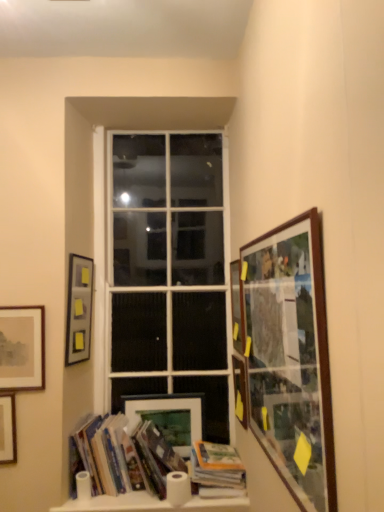
Question: Considering the relative sizes of white matte toilet paper at lower left, which ranks as the 1th toilet paper in left-to-right order, and matte glass picture frame at right, marked as the sixth picture frame in a left-to-right arrangement, in the image provided, is white matte toilet paper at lower left, which ranks as the 1th toilet paper in left-to-right order, thinner than matte glass picture frame at right, marked as the sixth picture frame in a left-to-right arrangement,?

Choices:
 (A) yes
 (B) no

Answer: (B)

Question: Does white matte toilet paper at lower left, which ranks as the 1th toilet paper in left-to-right order, have a larger size compared to matte glass picture frame at right, marked as the sixth picture frame in a left-to-right arrangement?

Choices:
 (A) yes
 (B) no

Answer: (B)

Question: Is white matte toilet paper at lower left, the second toilet paper when ordered from right to left, directly adjacent to matte glass picture frame at right, acting as the second picture frame starting from the right?

Choices:
 (A) no
 (B) yes

Answer: (A)

Question: Can you confirm if white matte toilet paper at lower left, the second toilet paper when ordered from right to left, is taller than matte glass picture frame at right, marked as the sixth picture frame in a left-to-right arrangement?

Choices:
 (A) yes
 (B) no

Answer: (B)

Question: Is white matte toilet paper at lower left, which ranks as the 1th toilet paper in left-to-right order, further to camera compared to matte glass picture frame at right, acting as the second picture frame starting from the right?

Choices:
 (A) yes
 (B) no

Answer: (B)

Question: From the image's perspective, is hardcover books at lower left, placed as the second book when sorted from right to left, located above or below wooden-framed collage at right, positioned as the seventh picture frame in left-to-right order?

Choices:
 (A) below
 (B) above

Answer: (A)

Question: Considering their positions, is hardcover books at lower left, placed as the second book when sorted from right to left, located in front of or behind wooden-framed collage at right, positioned as the seventh picture frame in left-to-right order?

Choices:
 (A) front
 (B) behind

Answer: (B)

Question: Is hardcover books at lower left, placed as the second book when sorted from right to left, inside the boundaries of wooden-framed collage at right, positioned as the seventh picture frame in left-to-right order, or outside?

Choices:
 (A) outside
 (B) inside

Answer: (A)

Question: In terms of width, does hardcover books at lower left, placed as the second book when sorted from right to left, look wider or thinner when compared to wooden-framed collage at right, the 1th picture frame when ordered from right to left?

Choices:
 (A) wide
 (B) thin

Answer: (A)

Question: Which is correct: matte brown picture frame at left, which is counted as the 2th picture frame, starting from the left, is inside matte wooden picture frame at lower center, acting as the 4th picture frame starting from the right, or outside of it?

Choices:
 (A) outside
 (B) inside

Answer: (A)

Question: From the image's perspective, is matte brown picture frame at left, acting as the 6th picture frame starting from the right, above or below matte wooden picture frame at lower center, acting as the 4th picture frame starting from the right?

Choices:
 (A) below
 (B) above

Answer: (B)

Question: Is matte brown picture frame at left, acting as the 6th picture frame starting from the right, bigger or smaller than matte wooden picture frame at lower center, acting as the 4th picture frame starting from the right?

Choices:
 (A) big
 (B) small

Answer: (A)

Question: Considering the positions of matte brown picture frame at left, which is counted as the 2th picture frame, starting from the left, and matte wooden picture frame at lower center, acting as the 4th picture frame starting from the right, in the image, is matte brown picture frame at left, which is counted as the 2th picture frame, starting from the left, taller or shorter than matte wooden picture frame at lower center, acting as the 4th picture frame starting from the right,?

Choices:
 (A) short
 (B) tall

Answer: (B)

Question: Based on their sizes in the image, would you say matte black picture frame at lower left, which ranks as the 5th picture frame in right-to-left order, is bigger or smaller than matte glass picture frame at right, acting as the second picture frame starting from the right?

Choices:
 (A) big
 (B) small

Answer: (A)

Question: Considering their positions, is matte black picture frame at lower left, which ranks as the 5th picture frame in right-to-left order, located in front of or behind matte glass picture frame at right, acting as the second picture frame starting from the right?

Choices:
 (A) front
 (B) behind

Answer: (B)